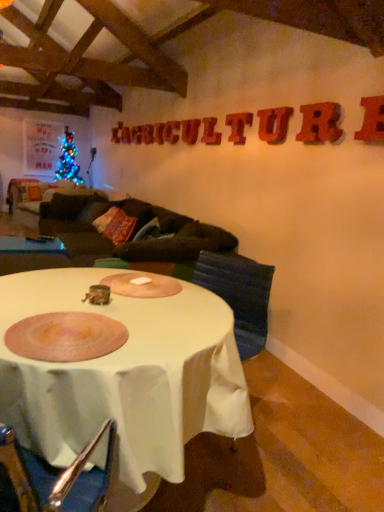
Question: From the image's perspective, is matte red letter at upper center, which is the 2th letter in left-to-right order, located above or below rubberized red letter at upper right, the ninth letter positioned from the back?

Choices:
 (A) below
 (B) above

Answer: (B)

Question: Considering the positions of matte red letter at upper center, positioned as the eighth letter in front-to-back order, and rubberized red letter at upper right, which is the first letter in right-to-left order, in the image, is matte red letter at upper center, positioned as the eighth letter in front-to-back order, bigger or smaller than rubberized red letter at upper right, which is the first letter in right-to-left order,?

Choices:
 (A) big
 (B) small

Answer: (B)

Question: Considering the real-world distances, which object is closest to the wooden letter t at upper center, marked as the 4th letter in a right-to-left arrangement?

Choices:
 (A) white glossy table at lower left, placed as the 2th table when sorted from right to left
 (B) wooden letter at center, the 1th letter in the left-to-right sequence
 (C) wooden textured letter at upper center, which is counted as the fourth letter, starting from the left
 (D) blue fabric armchair at center
 (E) matte red letter at upper center, which is the 2th letter in left-to-right order

Answer: (C)

Question: Based on their relative distances, which object is farther from the wooden textured letter at upper center, which is counted as the fourth letter, starting from the left?

Choices:
 (A) matte red letter at center, which appears as the 3th letter when viewed from the left
 (B) rubberized red letter r at upper right, acting as the 2th letter starting from the front
 (C) white cloth-covered table at center, placed as the first table when sorted from front to back
 (D) rubberized red letter at upper right, the ninth letter positioned from the back
 (E) white glossy table at lower left, which ranks as the first table in left-to-right order

Answer: (C)